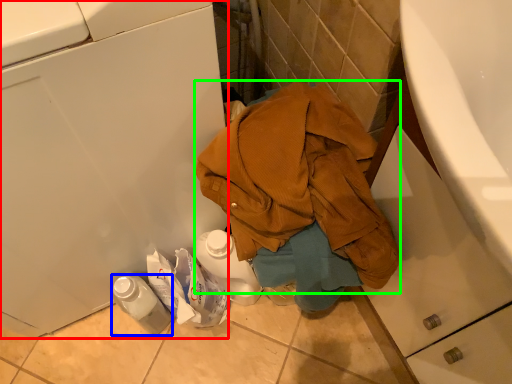
Question: Considering the real-world distances, which object is farthest from washing machine (highlighted by a red box)? bottle (highlighted by a blue box) or waste (highlighted by a green box)?

Choices:
 (A) bottle
 (B) waste

Answer: (A)